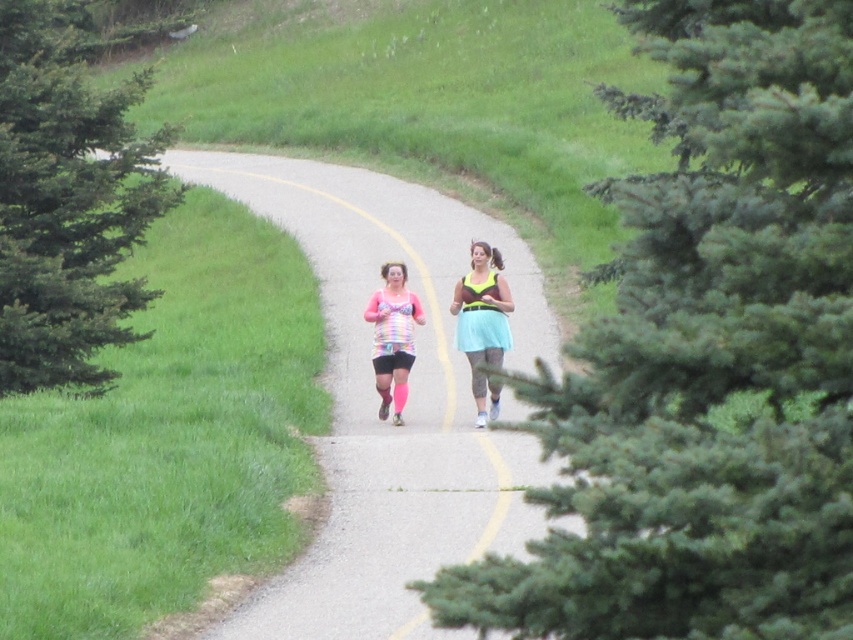
Question: Is smooth asphalt road at center to the left of rainbow fabric tank top at center from the viewer's perspective?

Choices:
 (A) no
 (B) yes

Answer: (B)

Question: Among these objects, which one is nearest to the camera?

Choices:
 (A) smooth asphalt road at center
 (B) green needle-like pine at left

Answer: (A)

Question: Observing the image, what is the correct spatial positioning of smooth asphalt road at center in reference to rainbow fabric tank top at center?

Choices:
 (A) right
 (B) left

Answer: (B)

Question: Which of the following is the farthest from the observer?

Choices:
 (A) rainbow fabric tank top at center
 (B) smooth asphalt road at center

Answer: (A)

Question: Among these points, which one is farthest from the camera?

Choices:
 (A) (502, 364)
 (B) (125, 202)

Answer: (B)

Question: Can you confirm if smooth asphalt road at center is positioned above rainbow fabric tank top at center?

Choices:
 (A) yes
 (B) no

Answer: (A)